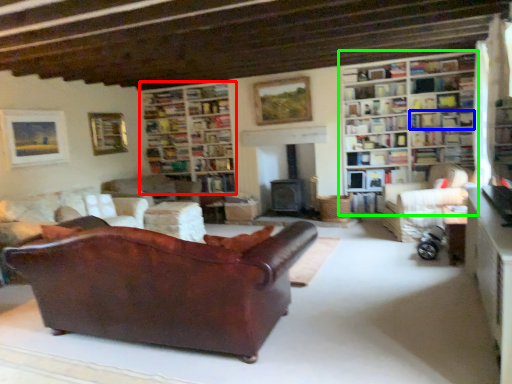
Question: Considering the real-world distances, which object is closest to bookcase (highlighted by a red box)? shelf (highlighted by a blue box) or bookcase (highlighted by a green box).

Choices:
 (A) shelf
 (B) bookcase

Answer: (B)